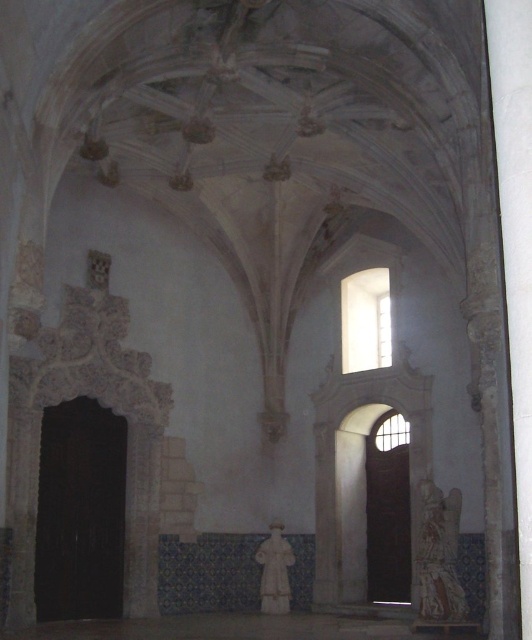
Does carved stone statue at right appear on the left side of white marble statue at center?

In fact, carved stone statue at right is to the right of white marble statue at center.

Is carved stone statue at right wider than white marble statue at center?

Yes.

Which is in front, point (438, 586) or point (278, 536)?

Positioned in front is point (438, 586).

Where is `carved stone statue at right`? The height and width of the screenshot is (640, 532). carved stone statue at right is located at coordinates (438, 556).